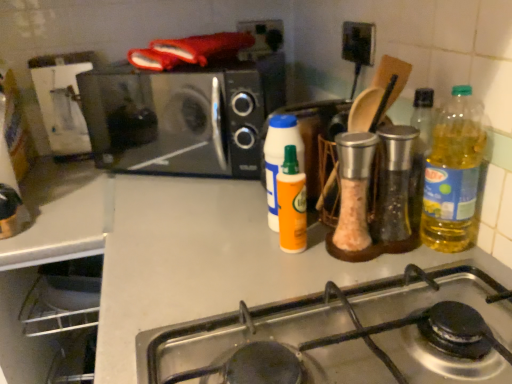
Find the location of a particular element. vacant space positioned to the left of translucent glass oil at center right, placed as the third bottle when sorted from left to right is located at coordinates (282, 252).